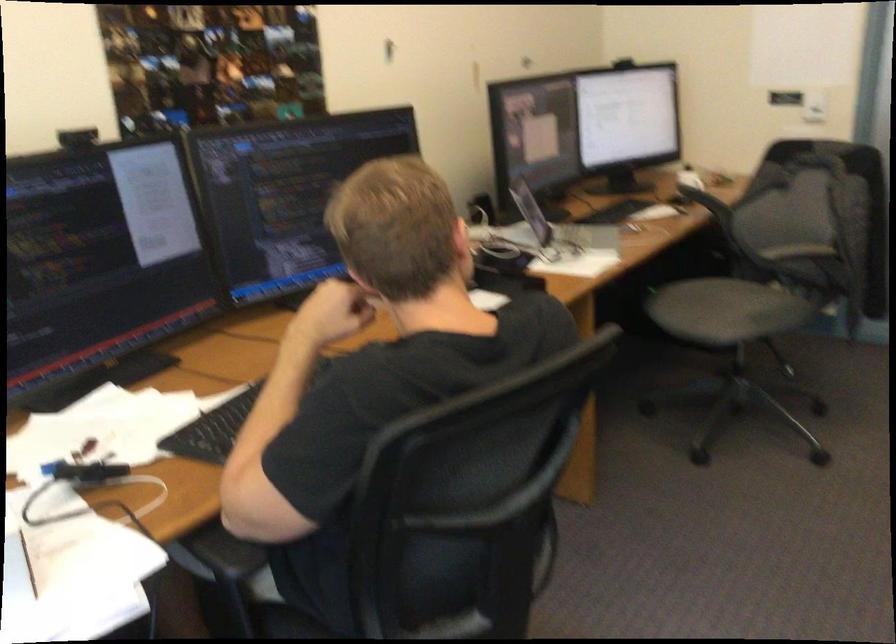
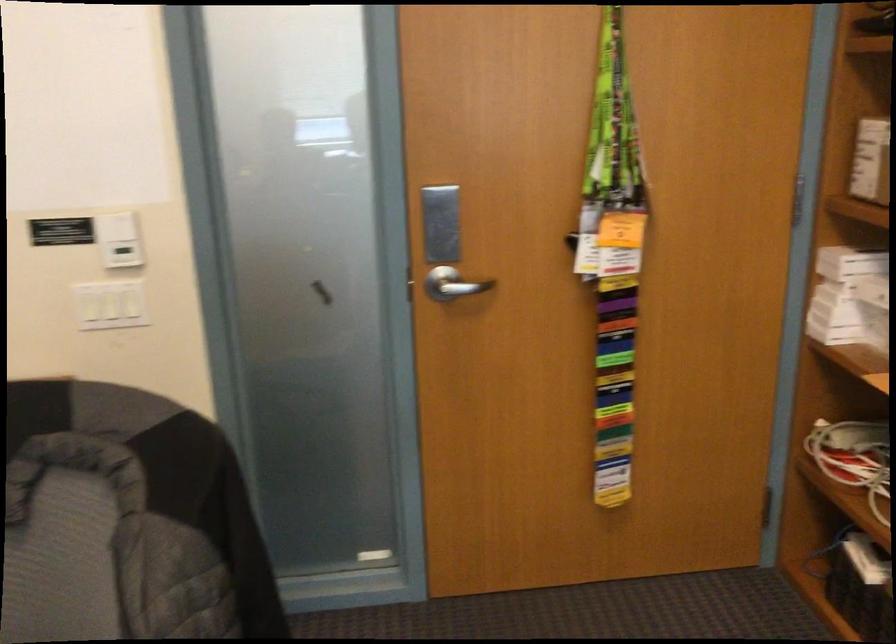
Locate, in the second image, the point that corresponds to (x=823, y=80) in the first image.

(116, 225)